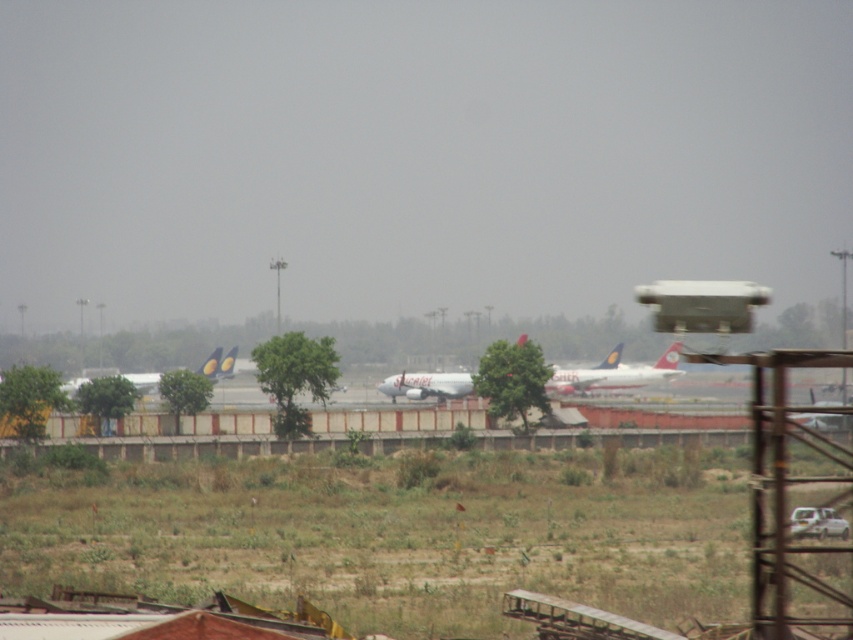
Question: Can you confirm if white glossy airplane at center is thinner than matte yellow airplane at center?

Choices:
 (A) no
 (B) yes

Answer: (B)

Question: In this image, where is white glossy airplane at center located relative to matte yellow airplane at center?

Choices:
 (A) left
 (B) right

Answer: (B)

Question: Which of the following is the closest to the observer?

Choices:
 (A) (640, 368)
 (B) (218, 369)

Answer: (B)

Question: Does white glossy airplane at center come behind matte yellow airplane at center?

Choices:
 (A) yes
 (B) no

Answer: (A)

Question: Which point is farther from the camera taking this photo?

Choices:
 (A) (74, 384)
 (B) (602, 387)

Answer: (B)